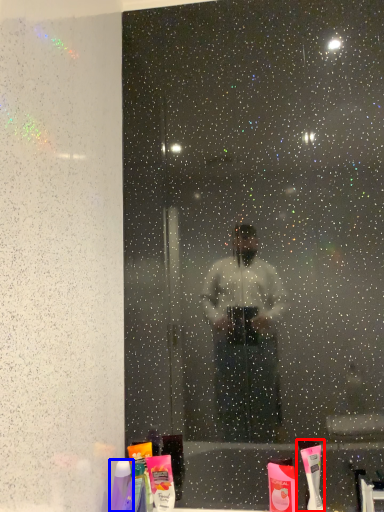
Question: Which object is closer to the camera taking this photo, toothbrush (highlighted by a red box) or toiletry (highlighted by a blue box)?

Choices:
 (A) toothbrush
 (B) toiletry

Answer: (B)